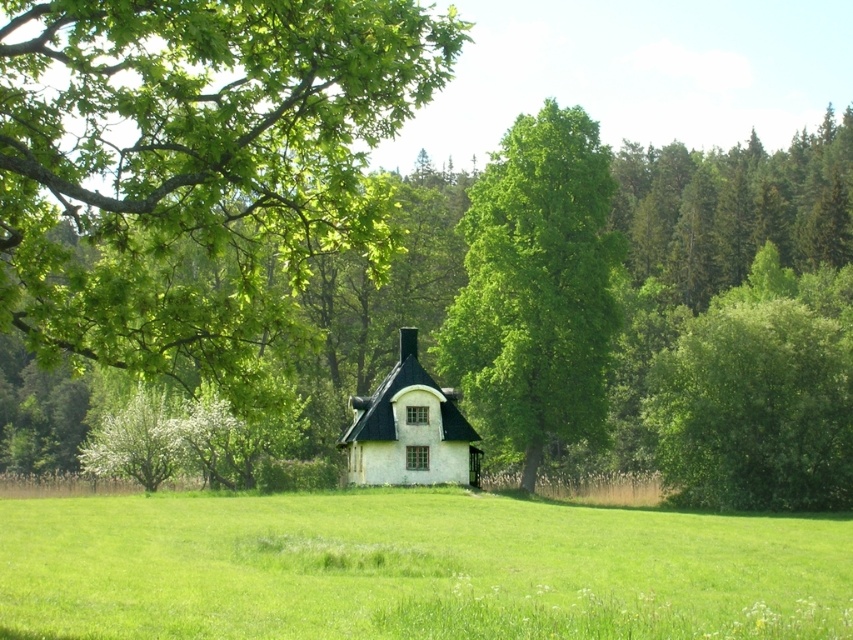
You are a gardener planning to plant a new tree in the green grassy field at center. Considering the height of the white matte cottage at center, will the tree grow taller than the cottage if it reaches its maximum height of 10 meters?

Result: The green grassy field at center is shorter than the white matte cottage at center, but the cottage height isn not specified. The tree can grow up to 10 meters, so it might surpass the cottage if it reaches that height.

You are standing in the middle of the green grassy field at center and the green leafy tree at center. Which object is more to the left?

The green grassy field at center is positioned on the left side of the green leafy tree at center, so the green grassy field at center is more to the left.

In the scene shown: You are standing in the middle of the green grassy field at center and want to walk to the white matte cottage at center. Which direction should you head to reach it?

The white matte cottage at center is above the green grassy field at center, so you should head upward to reach it.